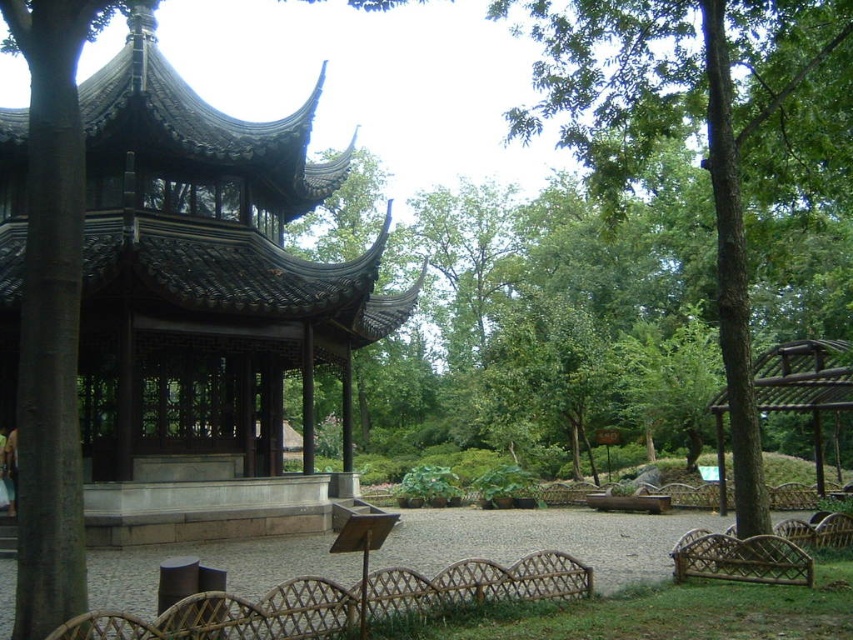
Who is lower down, dark brown wood gazebo at center or green leafy tree at center?

Positioned lower is dark brown wood gazebo at center.

Who is higher up, dark brown wood gazebo at center or green leafy tree at center?

green leafy tree at center is higher up.

Is point (163, 225) farther from camera compared to point (730, 400)?

Yes, point (163, 225) is farther from viewer.

I want to click on dark brown wood gazebo at center, so 206,307.